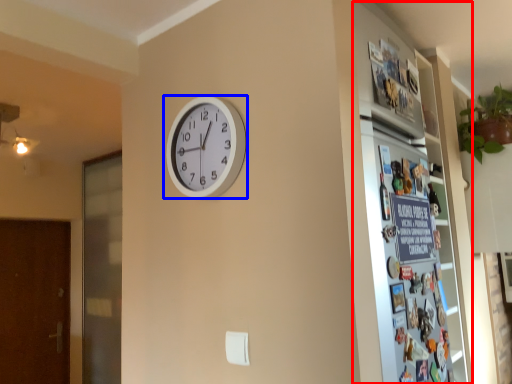
Question: Which object is further to the camera taking this photo, fridge (highlighted by a red box) or wall clock (highlighted by a blue box)?

Choices:
 (A) fridge
 (B) wall clock

Answer: (B)